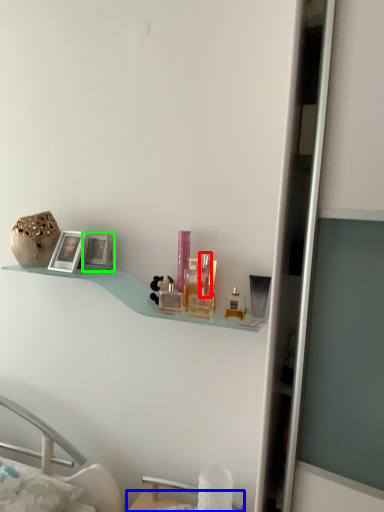
Question: Which object is the farthest from toiletry (highlighted by a red box)? Choose among these: table (highlighted by a blue box) or picture frame (highlighted by a green box).

Choices:
 (A) table
 (B) picture frame

Answer: (A)